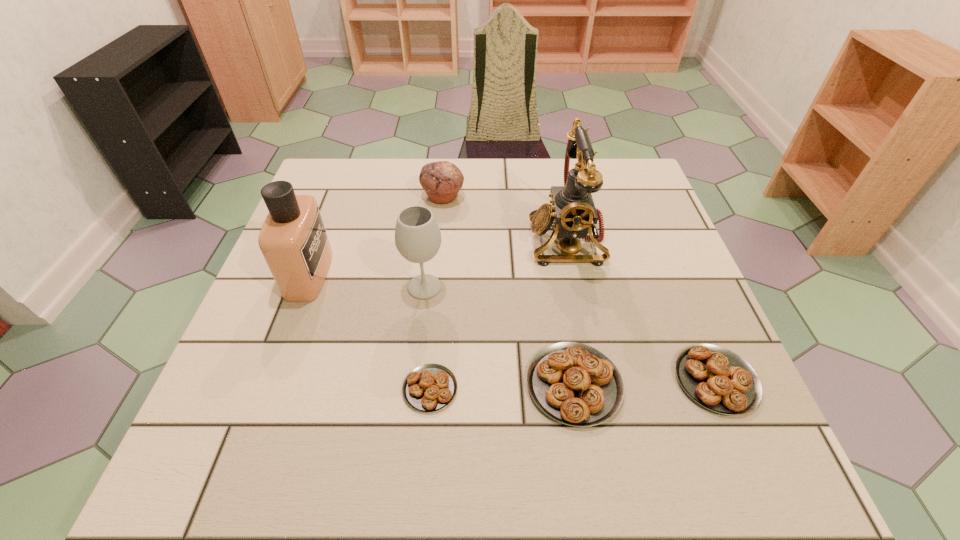
Please show where to add a pastry on the left while keeping spacing even. Please provide its 2D coordinates. Your answer should be formatted as a tuple, i.e. [(x, y)], where the tuple contains the x and y coordinates of a point satisfying the conditions above.

[(284, 393)]